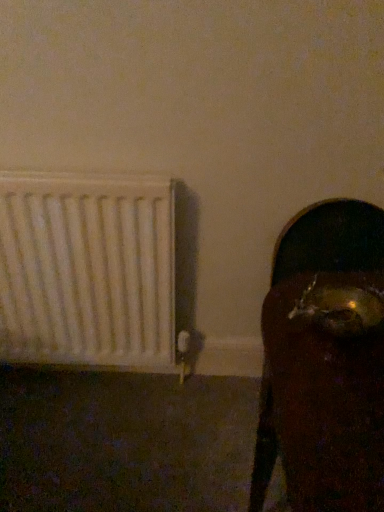
Question: Should I look upward or downward to see gold metallic skull at right?

Choices:
 (A) down
 (B) up

Answer: (A)

Question: Does gold metallic skull at right contain white matte radiator at left?

Choices:
 (A) yes
 (B) no

Answer: (B)

Question: From the image's perspective, would you say gold metallic skull at right is positioned over white matte radiator at left?

Choices:
 (A) no
 (B) yes

Answer: (A)

Question: Is gold metallic skull at right aimed at white matte radiator at left?

Choices:
 (A) no
 (B) yes

Answer: (A)

Question: Does gold metallic skull at right have a smaller size compared to white matte radiator at left?

Choices:
 (A) yes
 (B) no

Answer: (B)

Question: Considering the relative sizes of gold metallic skull at right and white matte radiator at left in the image provided, is gold metallic skull at right taller than white matte radiator at left?

Choices:
 (A) yes
 (B) no

Answer: (A)

Question: Does gold metallic skull at right have a greater width compared to white matte radiator at left?

Choices:
 (A) yes
 (B) no

Answer: (A)

Question: Does white matte radiator at left come in front of gold metallic skull at right?

Choices:
 (A) no
 (B) yes

Answer: (A)

Question: Is white matte radiator at left directly adjacent to gold metallic skull at right?

Choices:
 (A) no
 (B) yes

Answer: (A)

Question: From a real-world perspective, is white matte radiator at left on top of gold metallic skull at right?

Choices:
 (A) yes
 (B) no

Answer: (A)

Question: From the image's perspective, is white matte radiator at left under gold metallic skull at right?

Choices:
 (A) yes
 (B) no

Answer: (B)

Question: From the image's perspective, is white matte radiator at left located above gold metallic skull at right?

Choices:
 (A) yes
 (B) no

Answer: (A)

Question: Is gold metallic skull at right at the back of white matte radiator at left?

Choices:
 (A) yes
 (B) no

Answer: (B)

Question: From a real-world perspective, is white matte radiator at left physically located above or below gold metallic skull at right?

Choices:
 (A) below
 (B) above

Answer: (B)